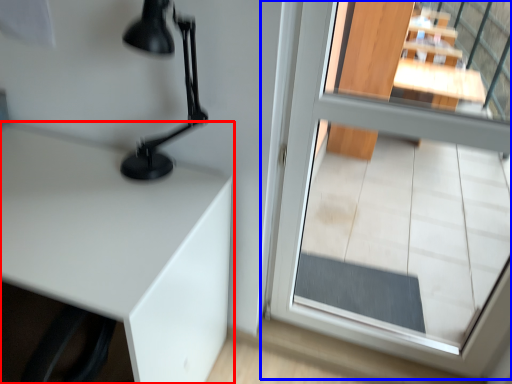
Question: Which object is closer to the camera taking this photo, table (highlighted by a red box) or glass door (highlighted by a blue box)?

Choices:
 (A) table
 (B) glass door

Answer: (B)